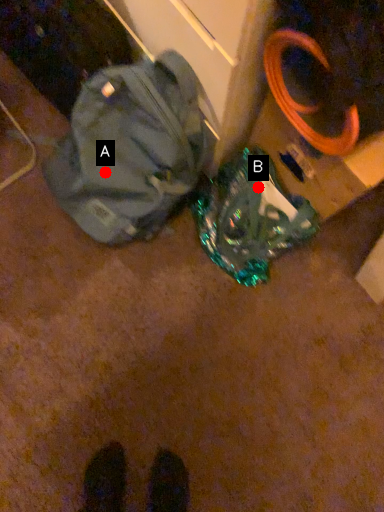
Question: Two points are circled on the image, labeled by A and B beside each circle. Which point is farther to the camera?

Choices:
 (A) A is further
 (B) B is further

Answer: (A)